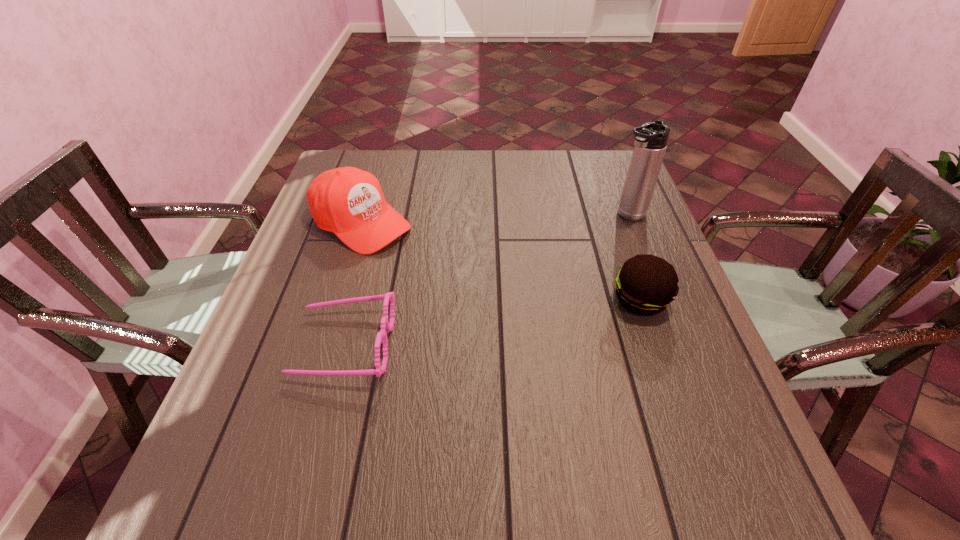
In the image, there is a desktop. Where is `free space at the right edge`? This screenshot has height=540, width=960. free space at the right edge is located at coordinates (682, 320).

The height and width of the screenshot is (540, 960). Find the location of `vacant region at the far left corner of the desktop`. vacant region at the far left corner of the desktop is located at coordinates (379, 160).

Locate an element on the screen. The height and width of the screenshot is (540, 960). free point at the near right corner is located at coordinates (735, 410).

Find the location of a particular element. The width and height of the screenshot is (960, 540). free point between the spectacles and the tallest object is located at coordinates (486, 280).

Locate an element on the screen. This screenshot has width=960, height=540. free space between the spectacles and the thermos bottle is located at coordinates (486, 280).

At what (x,y) coordinates should I click in order to perform the action: click on empty space between the spectacles and the third shortest object. Please return your answer as a coordinate pair (x, y). Image resolution: width=960 pixels, height=540 pixels. Looking at the image, I should click on (352, 284).

You are a GUI agent. You are given a task and a screenshot of the screen. Output one action in this format:
    pyautogui.click(x=<x>, y=<y>)
    Task: Click on the vacant space that's between the shortest object and the baseball cap
    
    Given the screenshot: What is the action you would take?
    pyautogui.click(x=352, y=284)

Locate an element on the screen. free space between the tallest object and the baseball cap is located at coordinates (494, 220).

What are the coordinates of `free space between the shortest object and the tallest object` in the screenshot? It's located at (486, 280).

The width and height of the screenshot is (960, 540). What are the coordinates of `free space between the second shortest object and the baseball cap` in the screenshot? It's located at click(x=500, y=262).